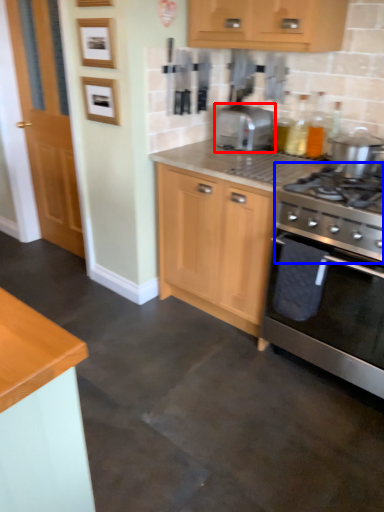
Question: Which object is closer to the camera taking this photo, toaster (highlighted by a red box) or gas stove (highlighted by a blue box)?

Choices:
 (A) toaster
 (B) gas stove

Answer: (B)